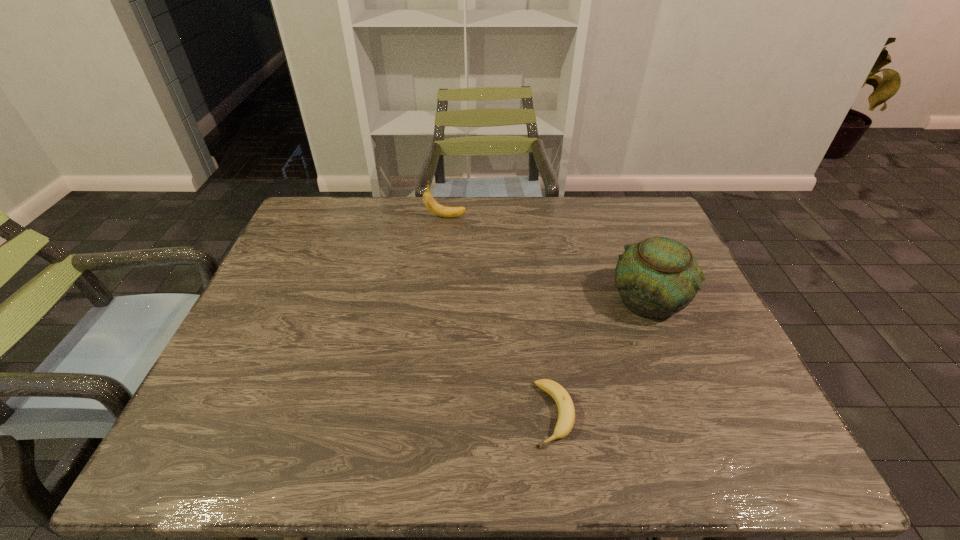
Locate an element on the screen. The width and height of the screenshot is (960, 540). object that is at the right edge is located at coordinates (658, 277).

This screenshot has height=540, width=960. Identify the location of vacant space at the far edge of the desktop. (458, 219).

Locate an element on the screen. This screenshot has height=540, width=960. free location at the near edge is located at coordinates (274, 456).

In order to click on vacant space at the left edge of the desktop in this screenshot , I will do point(253,364).

Locate an element on the screen. The image size is (960, 540). free space at the right edge of the desktop is located at coordinates (759, 397).

Find the location of a particular element. Image resolution: width=960 pixels, height=540 pixels. vacant area between the taller banana and the pottery is located at coordinates (547, 258).

You are a GUI agent. You are given a task and a screenshot of the screen. Output one action in this format:
    pyautogui.click(x=<x>, y=<y>)
    Task: Click on the empty location between the tallest object and the shortest object
    The image size is (960, 540).
    Given the screenshot: What is the action you would take?
    pyautogui.click(x=601, y=357)

The width and height of the screenshot is (960, 540). I want to click on vacant point located between the taller banana and the rightmost object, so click(x=547, y=258).

In order to click on free space between the rightmost object and the second shortest object in this screenshot , I will do `click(547, 258)`.

The height and width of the screenshot is (540, 960). I want to click on vacant space that is in between the nearer banana and the left banana, so click(499, 315).